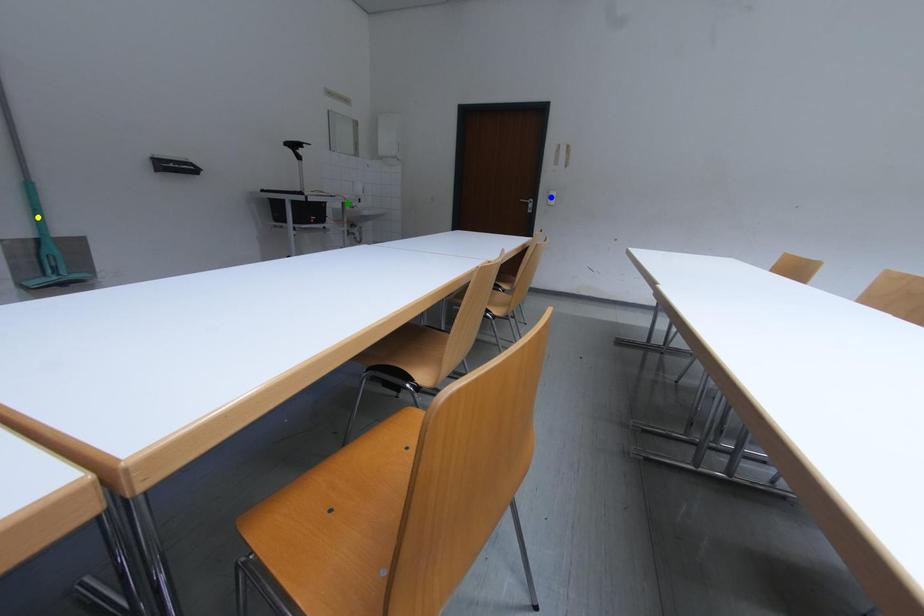
Consider the image. Order these from farthest to nearest:
1. yellow point
2. green point
3. blue point

1. green point
2. blue point
3. yellow point